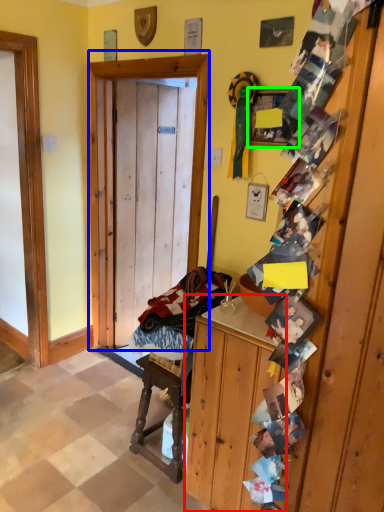
Question: Which object is the closest to the cabinetry (highlighted by a red box)? Choose among these: door (highlighted by a blue box) or picture frame (highlighted by a green box).

Choices:
 (A) door
 (B) picture frame

Answer: (A)